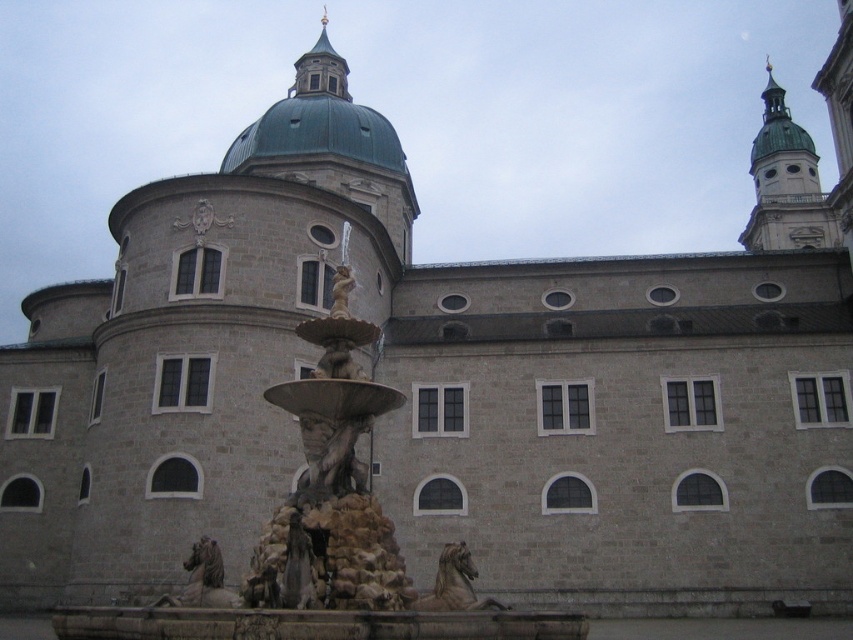
Question: From the image, what is the correct spatial relationship of green metallic dome at upper center in relation to matte stone statue at center?

Choices:
 (A) left
 (B) right

Answer: (A)

Question: Is stone sculpture fountain at center bigger than polished bronze horse at lower center?

Choices:
 (A) no
 (B) yes

Answer: (B)

Question: Among these objects, which one is farthest from the camera?

Choices:
 (A) stone sculpture fountain at center
 (B) green copper tower at upper right
 (C) polished bronze horse at lower center

Answer: (B)

Question: Which of these objects is positioned closest to the green copper tower at upper right?

Choices:
 (A) polished bronze horse at lower center
 (B) stone sculpture fountain at center

Answer: (B)

Question: Is green copper tower at upper right positioned at the back of matte stone statue at center?

Choices:
 (A) yes
 (B) no

Answer: (A)

Question: Which object is the closest to the green metallic dome at upper center?

Choices:
 (A) matte stone statue at center
 (B) green copper tower at upper right
 (C) stone sculpture fountain at center

Answer: (A)